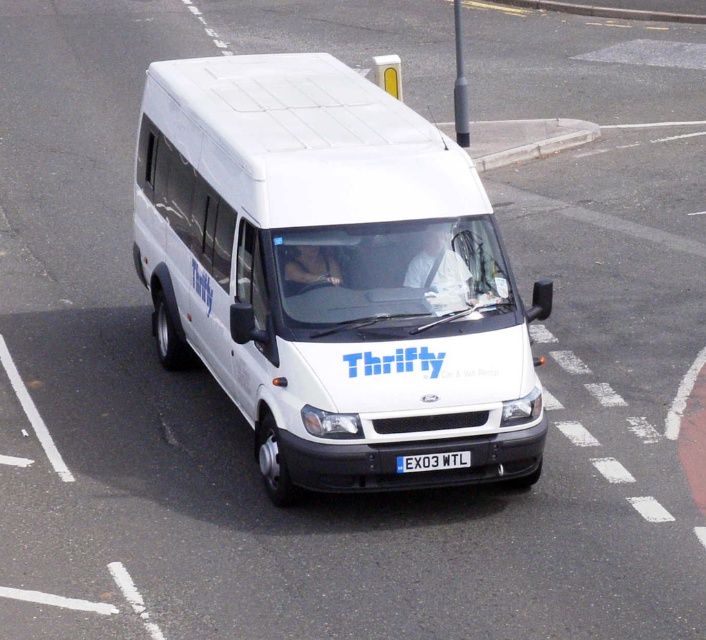
Which of these two, white matte van at center or white plastic license plate at center, stands shorter?

white plastic license plate at center

Image resolution: width=706 pixels, height=640 pixels. Identify the location of white matte van at center. (333, 275).

Where is `white matte van at center`? This screenshot has width=706, height=640. white matte van at center is located at coordinates (333, 275).